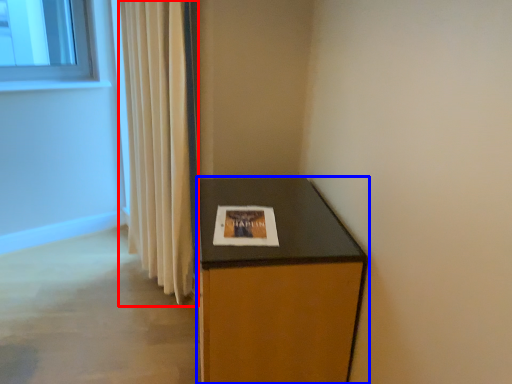
Question: Which object is closer to the camera taking this photo, curtain (highlighted by a red box) or furniture (highlighted by a blue box)?

Choices:
 (A) curtain
 (B) furniture

Answer: (B)